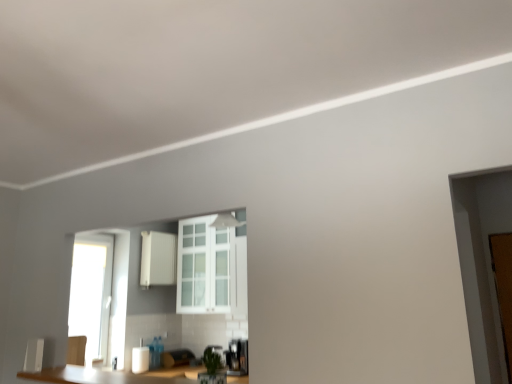
Locate an element on the screen. The width and height of the screenshot is (512, 384). white matte cabinet at center is located at coordinates (158, 258).

What do you see at coordinates (158, 258) in the screenshot? I see `white matte cabinet at center` at bounding box center [158, 258].

Measure the distance between point [501,255] and camera.

Point [501,255] and camera are 3.42 meters apart.

Measure the distance between point [200,275] and camera.

The depth of point [200,275] is 4.89 meters.

Identify the location of white matte cabinet at center. [x=158, y=258].

Is brown wooden door at right to the left of white glass cabinet at center from the viewer's perspective?

In fact, brown wooden door at right is to the right of white glass cabinet at center.

Considering the sizes of objects brown wooden door at right and white glass cabinet at center in the image provided, who is smaller, brown wooden door at right or white glass cabinet at center?

brown wooden door at right is smaller.

Is brown wooden door at right wider or thinner than white glass cabinet at center?

brown wooden door at right is thinner than white glass cabinet at center.

How distant is white glossy paper towel dispenser at lower center from white matte cabinet at center?

white glossy paper towel dispenser at lower center and white matte cabinet at center are 5.90 feet apart from each other.

Does white glossy paper towel dispenser at lower center have a greater height compared to white matte cabinet at center?

No.

Does point (134, 369) come closer to viewer compared to point (158, 271)?

That is True.

Between white glossy paper towel dispenser at lower center and white matte cabinet at center, which one has smaller size?

Smaller between the two is white glossy paper towel dispenser at lower center.

Can you confirm if white glass cabinet at center is smaller than white glossy paper towel dispenser at lower center?

Incorrect, white glass cabinet at center is not smaller in size than white glossy paper towel dispenser at lower center.

Are white glass cabinet at center and white glossy paper towel dispenser at lower center far apart?

Yes, white glass cabinet at center and white glossy paper towel dispenser at lower center are located far from each other.

Can you tell me how much white glass cabinet at center and white glossy paper towel dispenser at lower center differ in facing direction?

93.2 degrees separate the facing orientations of white glass cabinet at center and white glossy paper towel dispenser at lower center.

Is point (224, 307) behind point (511, 337)?

That is True.

In the image, there is a white glass cabinet at center. Where is `door below it (from a real-world perspective)`? This screenshot has height=384, width=512. door below it (from a real-world perspective) is located at coordinates (503, 288).

Is white glass cabinet at center turned away from brown wooden door at right?

That's not correct — white glass cabinet at center is not looking away from brown wooden door at right.

Would you say white glass cabinet at center is to the left or to the right of brown wooden door at right in the picture?

white glass cabinet at center is to the left of brown wooden door at right.

From a real-world perspective, who is located higher, white matte cabinet at center or white glossy paper towel dispenser at lower center?

white matte cabinet at center is physically above.

How distant is white matte cabinet at center from white glossy paper towel dispenser at lower center?

The distance of white matte cabinet at center from white glossy paper towel dispenser at lower center is 5.90 feet.

From their relative heights in the image, would you say white matte cabinet at center is taller or shorter than white glossy paper towel dispenser at lower center?

In the image, white matte cabinet at center appears to be taller than white glossy paper towel dispenser at lower center.

Considering their positions, is white matte cabinet at center located in front of or behind white glossy paper towel dispenser at lower center?

Clearly, white matte cabinet at center is behind white glossy paper towel dispenser at lower center.

Considering the sizes of objects brown wooden door at right and white matte cabinet at center in the image provided, who is taller, brown wooden door at right or white matte cabinet at center?

Standing taller between the two is brown wooden door at right.

Is brown wooden door at right oriented towards white matte cabinet at center?

No, brown wooden door at right is not aimed at white matte cabinet at center.

Relative to white matte cabinet at center, is brown wooden door at right in front or behind?

brown wooden door at right is in front of white matte cabinet at center.

Is brown wooden door at right far from white matte cabinet at center?

That's right, there is a large distance between brown wooden door at right and white matte cabinet at center.

Is white matte cabinet at center wider than white glass cabinet at center?

No.

Is white matte cabinet at center inside the boundaries of white glass cabinet at center, or outside?

white matte cabinet at center is outside white glass cabinet at center.

From a real-world perspective, is white matte cabinet at center positioned under white glass cabinet at center based on gravity?

Actually, white matte cabinet at center is physically above white glass cabinet at center in the real world.

The height and width of the screenshot is (384, 512). I want to click on cabinetry located above the white glass cabinet at center (from a real-world perspective), so click(158, 258).

The width and height of the screenshot is (512, 384). In order to click on door below the white glass cabinet at center (from the image's perspective) in this screenshot , I will do `click(503, 288)`.

Where is `cabinetry above the white glossy paper towel dispenser at lower center (from the image's perspective)`? cabinetry above the white glossy paper towel dispenser at lower center (from the image's perspective) is located at coordinates (158, 258).

Which object lies nearer to the anchor point white glossy paper towel dispenser at lower center, white glass cabinet at center or brown wooden door at right?

Among the two, white glass cabinet at center is located nearer to white glossy paper towel dispenser at lower center.

Based on their spatial positions, is white matte cabinet at center or white glass cabinet at center closer to white glossy paper towel dispenser at lower center?

Among the two, white glass cabinet at center is located nearer to white glossy paper towel dispenser at lower center.

When comparing their distances from white glass cabinet at center, does white matte cabinet at center or white glossy paper towel dispenser at lower center seem further?

The object further to white glass cabinet at center is white glossy paper towel dispenser at lower center.

Looking at the image, which one is located further to white glass cabinet at center, white glossy paper towel dispenser at lower center or brown wooden door at right?

brown wooden door at right.

When comparing their distances from brown wooden door at right, does white glossy paper towel dispenser at lower center or white matte cabinet at center seem closer?

white glossy paper towel dispenser at lower center is closer to brown wooden door at right.

Based on their spatial positions, is white glass cabinet at center or white matte cabinet at center closer to white glossy paper towel dispenser at lower center?

white glass cabinet at center lies closer to white glossy paper towel dispenser at lower center than the other object.

Based on the photo, looking at the image, which one is located closer to white glass cabinet at center, brown wooden door at right or white matte cabinet at center?

The object closer to white glass cabinet at center is white matte cabinet at center.

Estimate the real-world distances between objects in this image. Which object is further from white glossy paper towel dispenser at lower center, brown wooden door at right or white glass cabinet at center?

brown wooden door at right is positioned further to the anchor white glossy paper towel dispenser at lower center.

At what (x,y) coordinates should I click in order to perform the action: click on window between white glossy paper towel dispenser at lower center and brown wooden door at right. Please return your answer as a coordinate pair (x, y). This screenshot has height=384, width=512. Looking at the image, I should click on (205, 267).

Locate an element on the screen. This screenshot has width=512, height=384. window between white matte cabinet at center and white glossy paper towel dispenser at lower center in the vertical direction is located at coordinates (205, 267).

This screenshot has width=512, height=384. What are the coordinates of `cabinetry situated between white glossy paper towel dispenser at lower center and brown wooden door at right from left to right` in the screenshot? It's located at (158, 258).

The width and height of the screenshot is (512, 384). I want to click on window between white matte cabinet at center and brown wooden door at right from left to right, so (x=205, y=267).